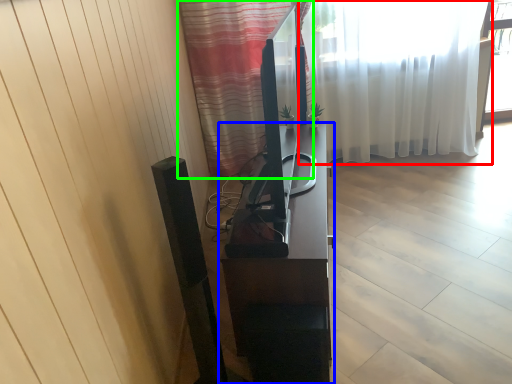
Question: Considering the real-world distances, which object is closest to curtain (highlighted by a red box)? furniture (highlighted by a blue box) or curtain (highlighted by a green box).

Choices:
 (A) furniture
 (B) curtain

Answer: (B)